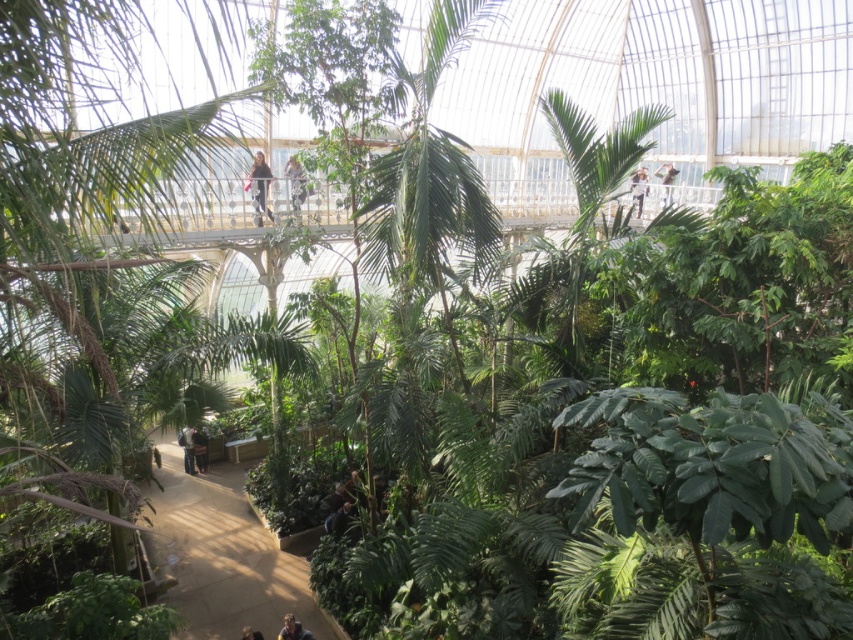
Between dark blue jeans at lower center and light brown wooden handrail at upper center, which one appears on the right side from the viewer's perspective?

light brown wooden handrail at upper center

In the scene shown: Who is positioned more to the left, dark blue jeans at lower center or light brown wooden handrail at upper center?

From the viewer's perspective, dark blue jeans at lower center appears more on the left side.

Between point (187, 436) and point (669, 163), which one is positioned in front?

Point (187, 436) is more forward.

Locate an element on the screen. dark blue jeans at lower center is located at coordinates (187, 449).

Can you confirm if white fabric at upper center is smaller than dark blue jeans at lower center?

No.

Between point (640, 177) and point (189, 432), which one is positioned in front?

Point (189, 432)

What do you see at coordinates (637, 188) in the screenshot? I see `white fabric at upper center` at bounding box center [637, 188].

Find the location of a particular element. white fabric at upper center is located at coordinates (637, 188).

Can you confirm if dark hair person at upper center is positioned above light brown leather jacket at upper center?

Actually, dark hair person at upper center is below light brown leather jacket at upper center.

Does point (264, 164) come farther from viewer compared to point (302, 193)?

Yes, point (264, 164) is farther from viewer.

Find the location of `dark hair person at upper center`. dark hair person at upper center is located at coordinates tap(259, 188).